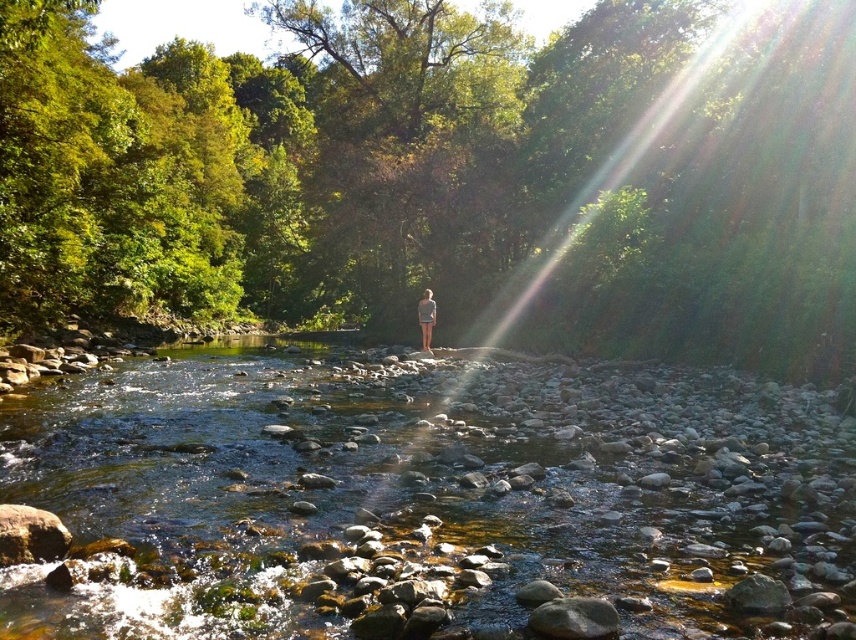
Who is higher up, clear water at center or light blue denim shorts at center?

light blue denim shorts at center

Between clear water at center and light blue denim shorts at center, which one has more height?

Standing taller between the two is light blue denim shorts at center.

Does point (361, 392) lie in front of point (429, 346)?

Yes, it is in front of point (429, 346).

Find the location of a particular element. This screenshot has width=856, height=640. clear water at center is located at coordinates (428, 497).

Is green leafy tree at center closer to camera compared to light blue denim shorts at center?

Yes, it is in front of light blue denim shorts at center.

Image resolution: width=856 pixels, height=640 pixels. What do you see at coordinates (449, 176) in the screenshot?
I see `green leafy tree at center` at bounding box center [449, 176].

This screenshot has width=856, height=640. What are the coordinates of `green leafy tree at center` in the screenshot? It's located at (449, 176).

Can you confirm if green leafy tree at center is thinner than clear water at center?

No.

Is point (565, 38) positioned before point (642, 419)?

That is False.

Is point (745, 56) closer to camera compared to point (728, 451)?

No, it is behind (728, 451).

At what (x,y) coordinates should I click in order to perform the action: click on green leafy tree at center. Please return your answer as a coordinate pair (x, y). The image size is (856, 640). Looking at the image, I should click on (449, 176).